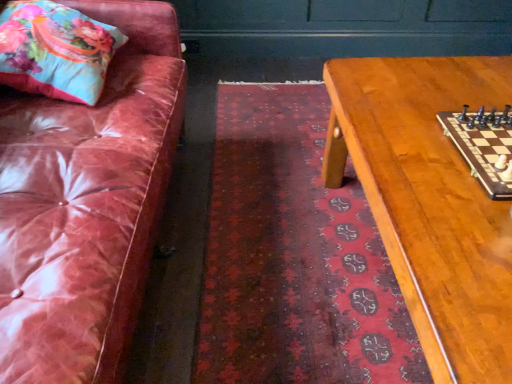
Locate an element on the screen. vacant point above wooden chessboard at center (from a real-world perspective) is located at coordinates (438, 150).